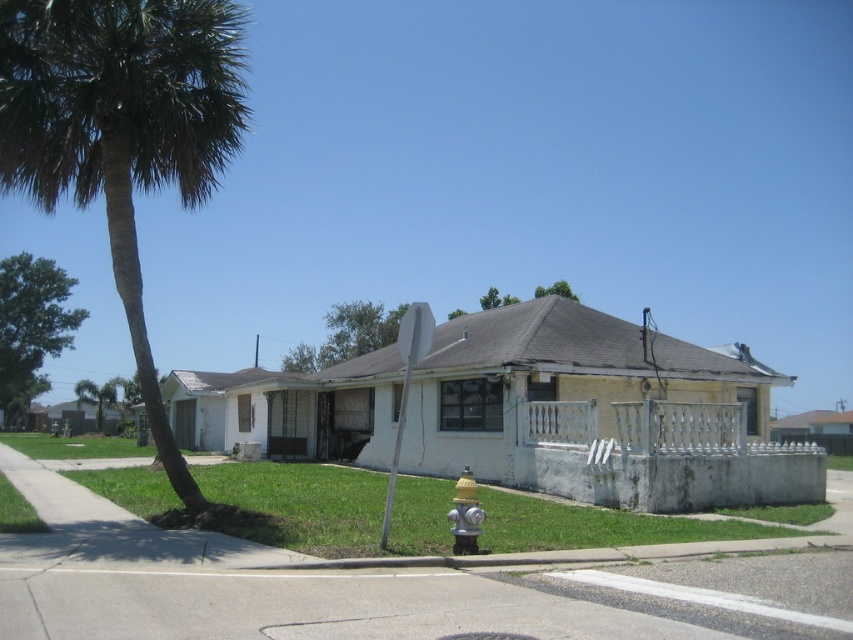
Question: Can you confirm if yellow metallic fire hydrant at lower center is positioned below green leafy tree at upper center?

Choices:
 (A) no
 (B) yes

Answer: (B)

Question: Which object is positioned closest to the green leafy palm tree at left?

Choices:
 (A) yellow metallic fire hydrant at lower center
 (B) green leafy tree at upper left

Answer: (A)

Question: Which object is the closest to the green leafy palm tree at left?

Choices:
 (A) green leafy tree at upper center
 (B) green leafy tree at upper left

Answer: (A)

Question: Based on their relative distances, which object is farther from the yellow metallic fire hydrant at lower center?

Choices:
 (A) green leafy palm tree at left
 (B) green leafy tree at upper center

Answer: (B)

Question: Does green leafy palm tree at left have a larger size compared to yellow metallic fire hydrant at lower center?

Choices:
 (A) no
 (B) yes

Answer: (B)

Question: Does green leafy palm tree at left have a greater width compared to yellow metallic fire hydrant at lower center?

Choices:
 (A) yes
 (B) no

Answer: (A)